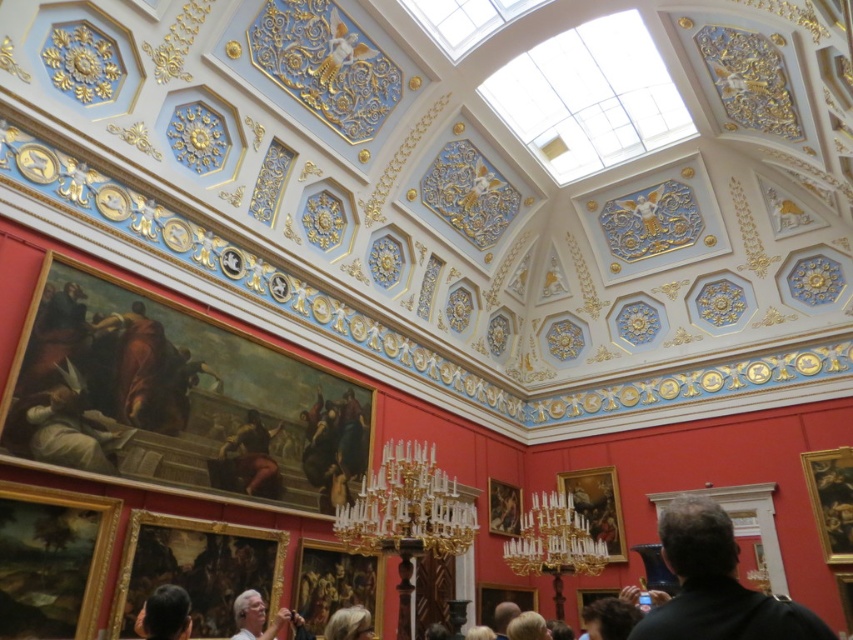
Question: Does black leather jacket at lower right come in front of gold plated chandelier at center?

Choices:
 (A) yes
 (B) no

Answer: (A)

Question: Among these points, which one is farthest from the camera?

Choices:
 (A) (140, 636)
 (B) (358, 614)

Answer: (B)

Question: Does black leather jacket at lower right appear on the right side of dark brown hair at lower left?

Choices:
 (A) yes
 (B) no

Answer: (A)

Question: Which of the following is the farthest from the observer?

Choices:
 (A) (149, 609)
 (B) (328, 634)
 (C) (468, 532)
 (D) (247, 605)

Answer: (C)

Question: Estimate the real-world distances between objects in this image. Which object is closer to the white hair at lower center?

Choices:
 (A) blonde hair at lower center
 (B) black leather jacket at lower right
 (C) gold plated chandelier at center
 (D) dark brown hair at lower left

Answer: (A)

Question: Is gold plated chandelier at center positioned before white hair at lower center?

Choices:
 (A) yes
 (B) no

Answer: (B)